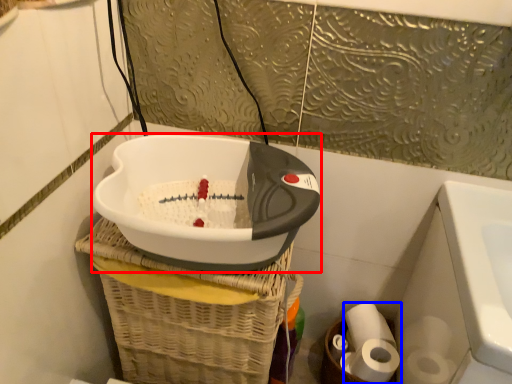
Question: Which object is further to the camera taking this photo, appliance (highlighted by a red box) or toilet paper (highlighted by a blue box)?

Choices:
 (A) appliance
 (B) toilet paper

Answer: (B)